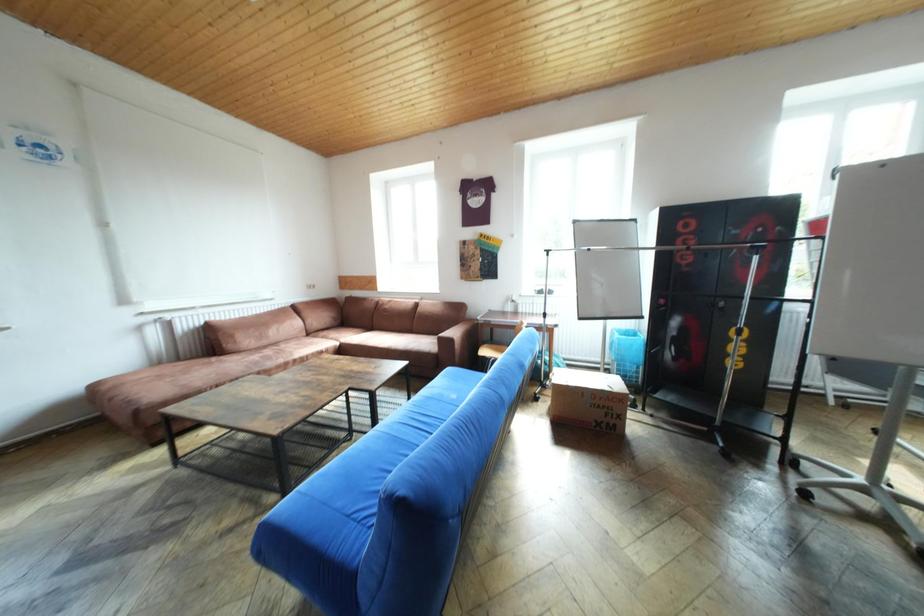
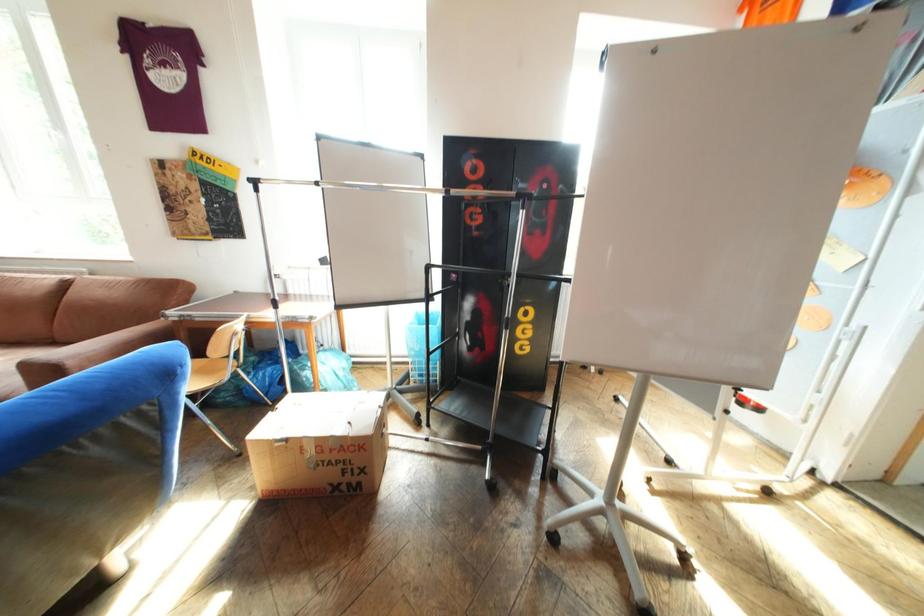
What movement of the cameraman would produce the second image?

The movement direction of the cameraman is right, forward.